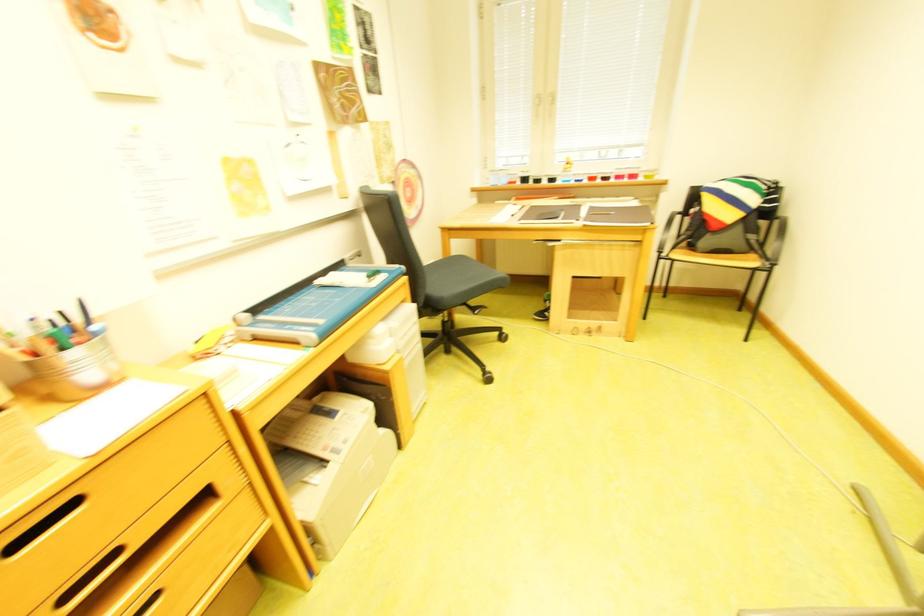
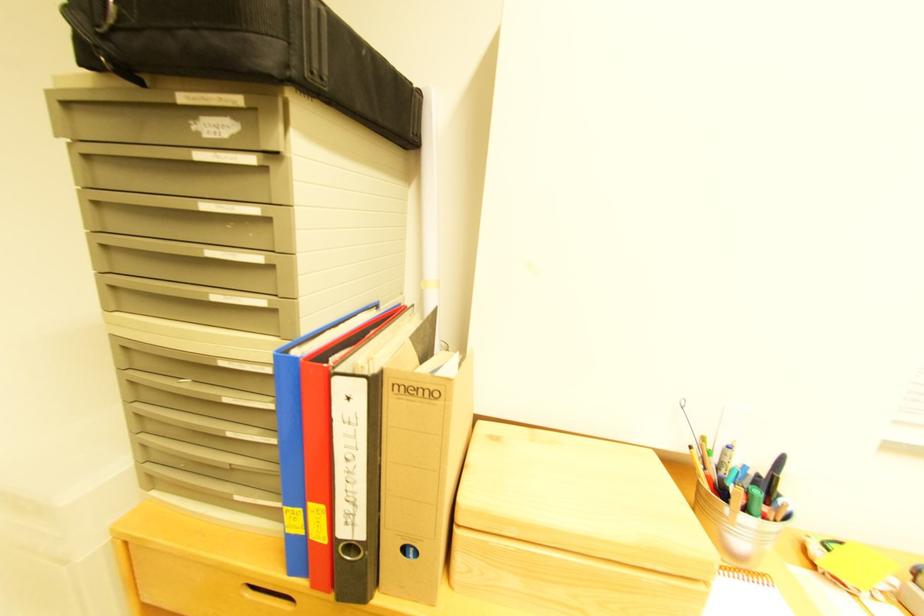
Question: Based on the continuous images, in which direction is the camera rotating? Reply with the corresponding letter.

Choices:
 (A) Left
 (B) Right
 (C) Up
 (D) Down

Answer: (A)